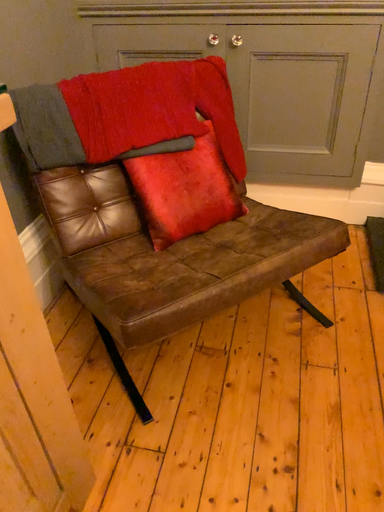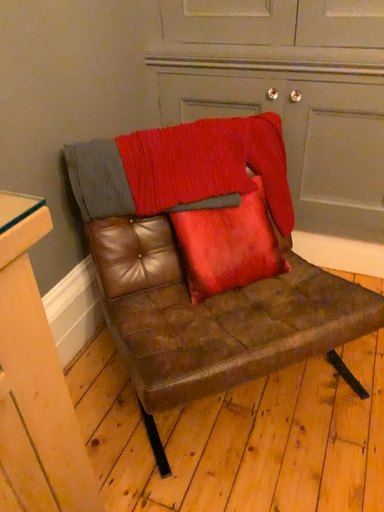
Question: Which way did the camera rotate in the video?

Choices:
 (A) rotated right
 (B) rotated left

Answer: (B)